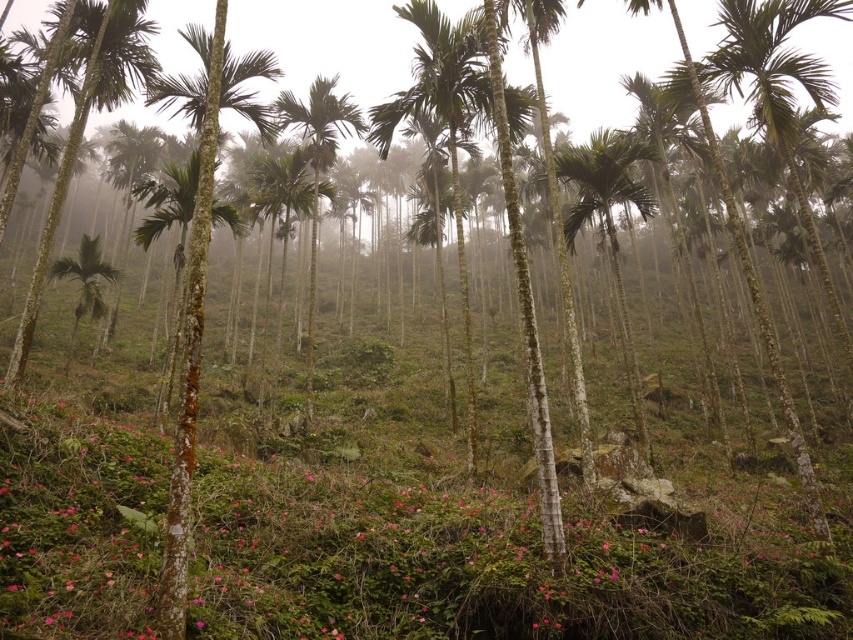
You are a hiker who has just entered the forest and wants to pick the pink matte flower at center. Can you reach it without moving past the green smooth palm tree at left?

The pink matte flower at center is closer to the viewer than the green smooth palm tree at left, so you can reach it without moving past the green smooth palm tree at left.

You are a hiker standing in the dense forest depicted in the scene. You notice the pink matte flower at center and the green glossy palm tree at left. Which object is closer to the ground?

The pink matte flower at center is shorter than the green glossy palm tree at left, so it is closer to the ground.

You are standing in the dense forest scene with tall palm trees. You want to take a photo of the green leafy palm tree at center from a distance where it will appear as large as possible in your camera frame. Based on its current distance, what is the closest you can get to the tree to achieve this?

The green leafy palm tree at center is 27.61 feet from camera. To make it appear as large as possible in the camera frame, you should move as close as possible to the tree, but since the current distance is 27.61 feet, that is the closest you can get without moving beyond the camera position.